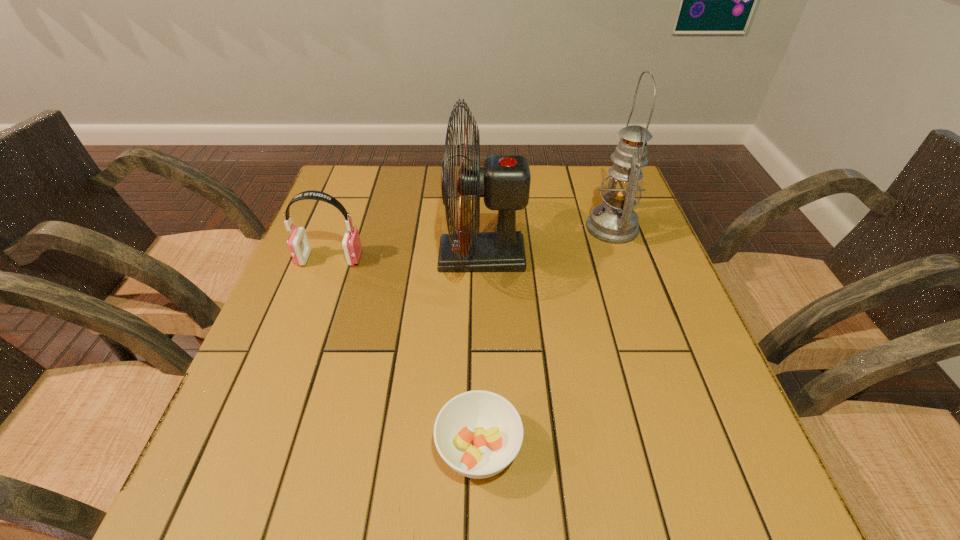
The width and height of the screenshot is (960, 540). I want to click on the rightmost object, so point(614,221).

Find the location of a particular element. fan is located at coordinates pyautogui.click(x=504, y=181).

Identify the location of the second shortest object. (298, 243).

Locate an element on the screen. earphone is located at coordinates (298, 243).

Where is `the shortest object`? the shortest object is located at coordinates (478, 433).

Find the location of a particular element. The width and height of the screenshot is (960, 540). the nearest object is located at coordinates (478, 433).

Where is `vacant area situated 0.190m on the left of the rightmost object`? This screenshot has height=540, width=960. vacant area situated 0.190m on the left of the rightmost object is located at coordinates (515, 227).

The height and width of the screenshot is (540, 960). I want to click on vacant space situated 0.070m on the front-facing side of the fan, so click(411, 256).

You are a GUI agent. You are given a task and a screenshot of the screen. Output one action in this format:
    pyautogui.click(x=<x>, y=<y>)
    Task: Click on the free region located 0.080m on the front-facing side of the fan
    Image resolution: width=960 pixels, height=540 pixels.
    Given the screenshot: What is the action you would take?
    pyautogui.click(x=407, y=256)

This screenshot has height=540, width=960. In order to click on free space located 0.300m on the front-facing side of the fan in this screenshot , I will do `click(318, 256)`.